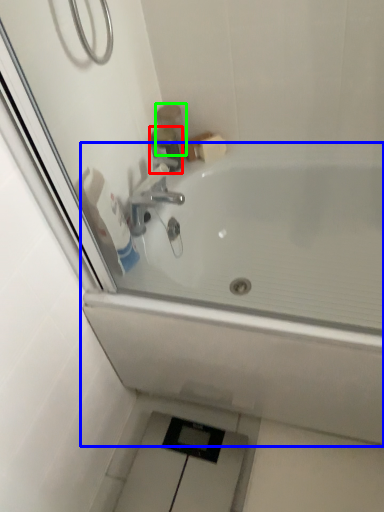
Question: Estimate the real-world distances between objects in this image. Which object is closer to plumbing fixture (highlighted by a red box), bathtub (highlighted by a blue box) or toiletry (highlighted by a green box)?

Choices:
 (A) bathtub
 (B) toiletry

Answer: (B)